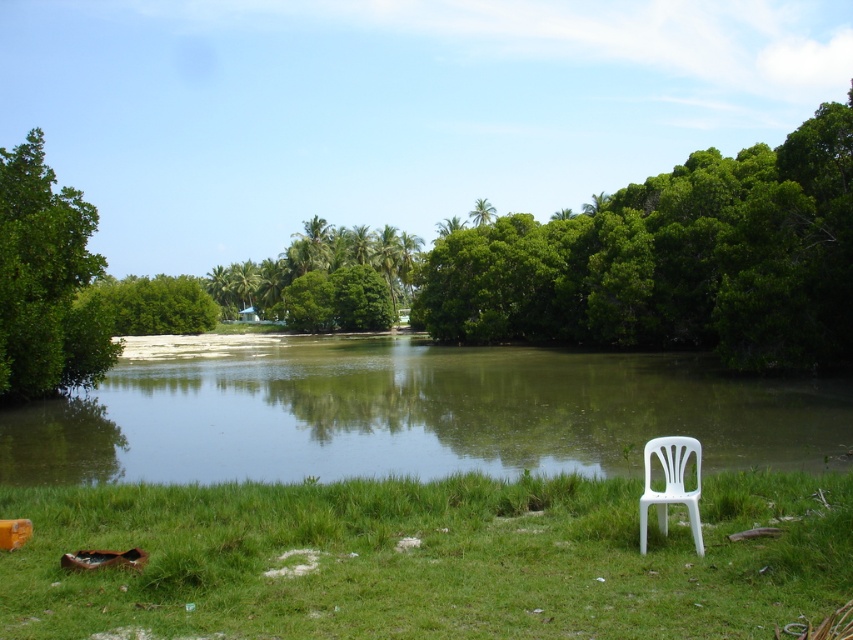
Can you confirm if green leafy tree at left is positioned below green leafy tree at upper center?

No, green leafy tree at left is not below green leafy tree at upper center.

Who is higher up, green leafy tree at left or green leafy tree at upper center?

Positioned higher is green leafy tree at left.

Does point (20, 262) lie behind point (469, 220)?

No, (20, 262) is closer to viewer.

Identify the location of green leafy tree at left. This screenshot has width=853, height=640. (45, 280).

Is point (555, 499) positioned after point (839, 422)?

No, (555, 499) is closer to viewer.

Is green grass at lower right closer to the viewer compared to green grassy lake at center?

Yes, it is in front of green grassy lake at center.

Is point (781, 490) less distant than point (584, 356)?

Yes, it is.

Where is `green grass at lower right`? The image size is (853, 640). green grass at lower right is located at coordinates (428, 557).

In the scene shown: Does green leafy tree at left have a smaller size compared to white plastic chair at lower right?

Incorrect, green leafy tree at left is not smaller in size than white plastic chair at lower right.

Between green leafy tree at left and white plastic chair at lower right, which one has less height?

white plastic chair at lower right

What are the coordinates of `green leafy tree at left` in the screenshot? It's located at (45, 280).